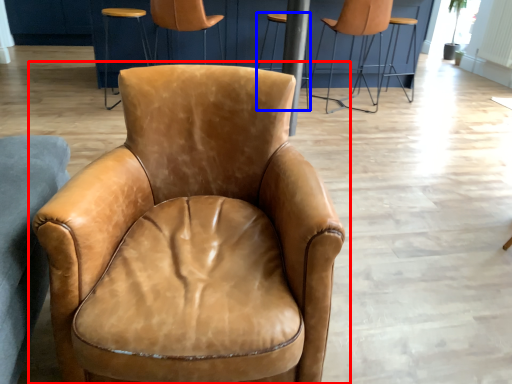
Question: Which object appears closest to the camera in this image, chair (highlighted by a red box) or bar stool (highlighted by a blue box)?

Choices:
 (A) chair
 (B) bar stool

Answer: (A)